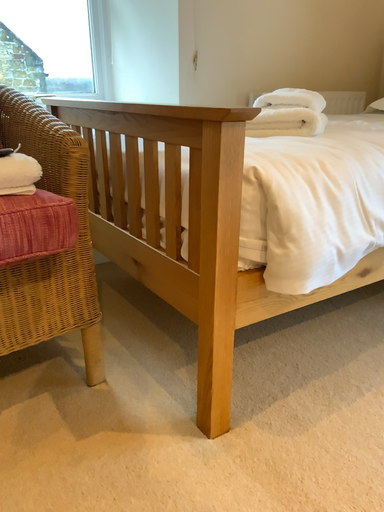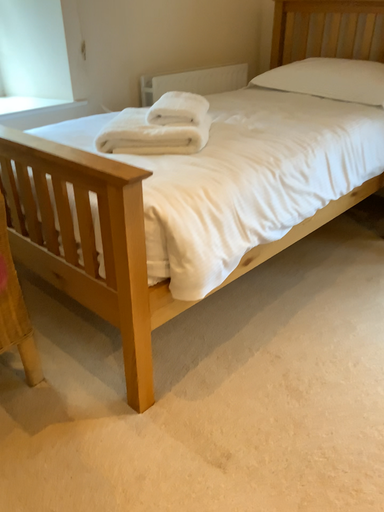
Question: Which way did the camera rotate in the video?

Choices:
 (A) rotated left
 (B) rotated right

Answer: (B)